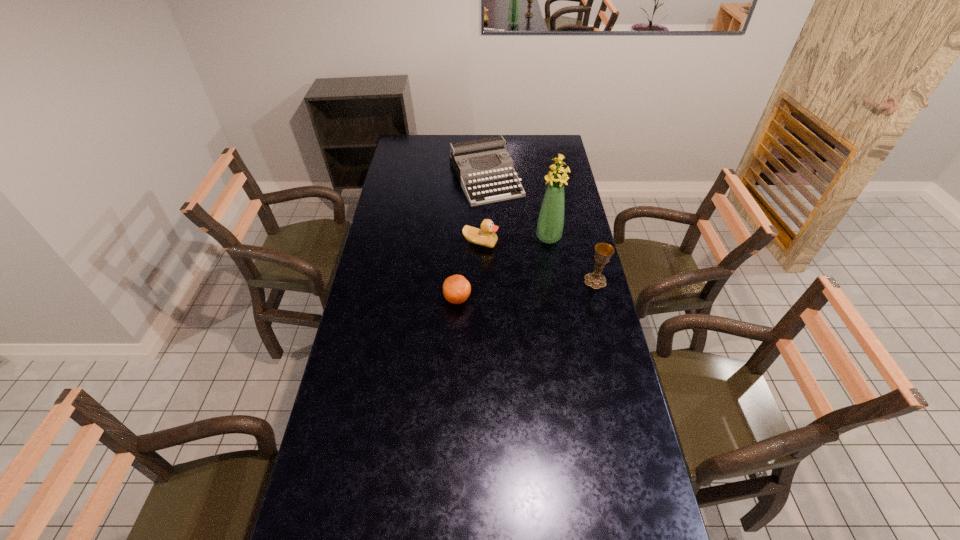
Find the location of a particular element. The height and width of the screenshot is (540, 960). bouquet located at the right edge is located at coordinates (550, 224).

In order to click on vacant space at the far edge of the desktop in this screenshot , I will do `click(509, 139)`.

In the image, there is a desktop. In order to click on free space at the near edge in this screenshot , I will do pos(584,502).

You are a GUI agent. You are given a task and a screenshot of the screen. Output one action in this format:
    pyautogui.click(x=<x>, y=<y>)
    Task: Click on the free location at the left edge of the desktop
    The image size is (960, 540).
    Given the screenshot: What is the action you would take?
    pyautogui.click(x=402, y=244)

In the image, there is a desktop. Where is `vacant space at the right edge`? vacant space at the right edge is located at coordinates (605, 374).

Where is `free space at the far right corner`? free space at the far right corner is located at coordinates (544, 138).

Image resolution: width=960 pixels, height=540 pixels. In order to click on free region at the near right corner of the desktop in this screenshot , I will do `click(621, 507)`.

Locate an element on the screen. free point between the typewriter and the bouquet is located at coordinates (517, 208).

Identify the location of blank region between the typewriter and the fourth object from left to right. (517, 208).

In order to click on vacant area that lies between the bouquet and the farthest object in this screenshot , I will do `click(517, 208)`.